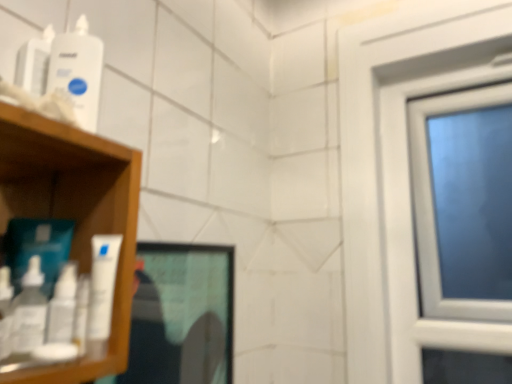
Question: Relative to white glossy mouthwash at left, placed as the third mouthwash when sorted from top to bottom, is white glossy tube at left, the second mouthwash ordered from the bottom, in front or behind?

Choices:
 (A) behind
 (B) front

Answer: (A)

Question: Would you say white glossy tube at left, the second mouthwash ordered from the bottom, is to the left or to the right of white glossy mouthwash at left, which is the 1th mouthwash in bottom-to-top order, in the picture?

Choices:
 (A) left
 (B) right

Answer: (B)

Question: Which object is positioned closest to the white glossy tube at left, the second mouthwash ordered from the bottom?

Choices:
 (A) white glossy mouthwash at left, placed as the third mouthwash when sorted from top to bottom
 (B) white plastic bottle at upper left, the 3th mouthwash positioned from the bottom

Answer: (A)

Question: Which object is positioned farthest from the white glossy tube at left, the second mouthwash ordered from the bottom?

Choices:
 (A) white glossy mouthwash at left, which is the 1th mouthwash in bottom-to-top order
 (B) white plastic bottle at upper left, the 3th mouthwash positioned from the bottom

Answer: (B)